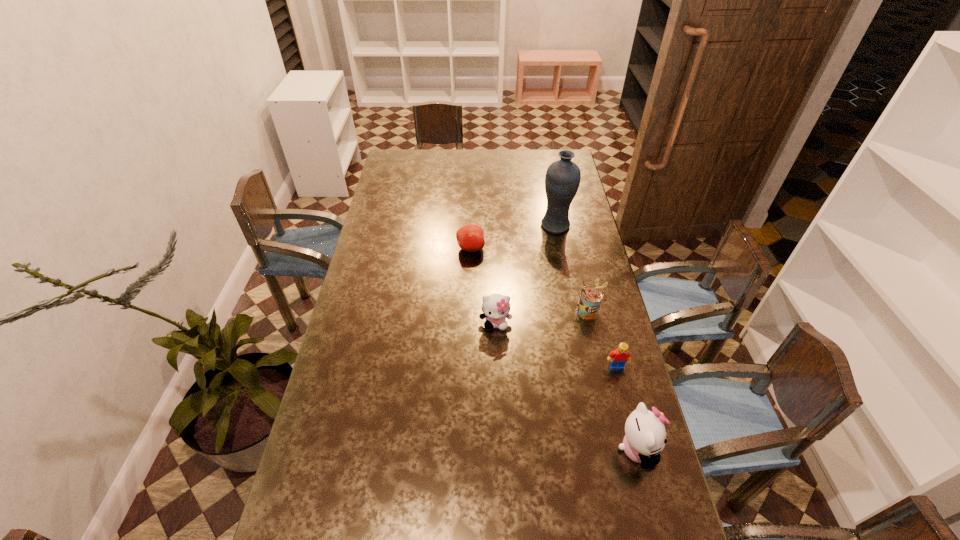
Locate an element on the screen. This screenshot has height=540, width=960. vacant space at the right edge of the desktop is located at coordinates (559, 267).

Identify the location of vacant point located between the farther kitten and the second farthest object. (483, 286).

What are the coordinates of `empty location between the can and the Lego` in the screenshot? It's located at (602, 338).

Locate an element on the screen. The height and width of the screenshot is (540, 960). free space between the right kitten and the Lego is located at coordinates (627, 408).

At what (x,y) coordinates should I click in order to perform the action: click on vacant region between the left kitten and the fifth shortest object. Please return your answer as a coordinate pair (x, y). Image resolution: width=960 pixels, height=540 pixels. Looking at the image, I should click on (566, 386).

Where is `free space between the can and the Lego`? free space between the can and the Lego is located at coordinates (602, 338).

The image size is (960, 540). I want to click on vacant space that is in between the right kitten and the can, so click(612, 380).

Identify the location of vacant area that lies between the second farthest object and the shorter kitten. (483, 286).

Find the location of a particular element. The image size is (960, 540). vacant area between the apple and the fifth farthest object is located at coordinates (543, 307).

In order to click on unoccupied area between the second nearest object and the apple in this screenshot , I will do pos(543,307).